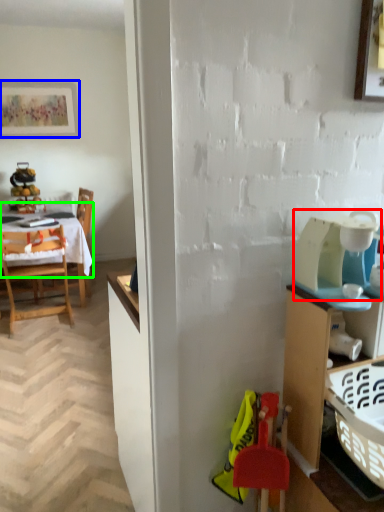
Question: Considering the real-world distances, which object is closest to appliance (highlighted by a red box)? picture frame (highlighted by a blue box) or tablecloth (highlighted by a green box).

Choices:
 (A) picture frame
 (B) tablecloth

Answer: (B)